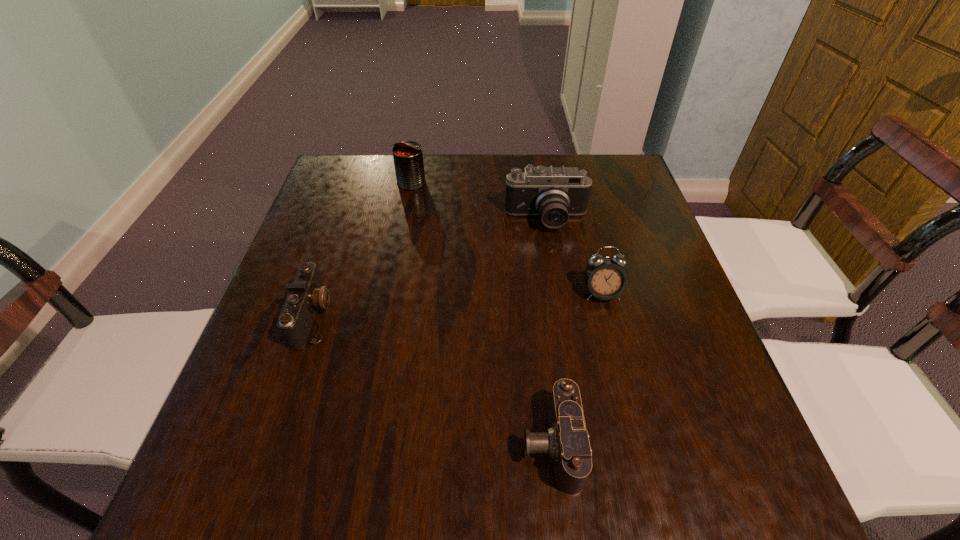
Where is `the farthest object`? The image size is (960, 540). the farthest object is located at coordinates (408, 156).

I want to click on the fourth object from right to left, so click(408, 156).

Find the location of `the second farthest object`. the second farthest object is located at coordinates (554, 193).

You are a GUI agent. You are given a task and a screenshot of the screen. Output one action in this format:
    pyautogui.click(x=<x>, y=<y>)
    Task: Click on the farthest camera
    Image resolution: width=960 pixels, height=540 pixels.
    Given the screenshot: What is the action you would take?
    pyautogui.click(x=554, y=193)

I want to click on alarm clock, so click(x=605, y=278).

Identify the location of the second farthest camera. (307, 293).

The width and height of the screenshot is (960, 540). I want to click on the leftmost object, so click(307, 293).

Where is `the nearest camera`? The height and width of the screenshot is (540, 960). the nearest camera is located at coordinates (566, 441).

Locate an element on the screen. vacant space located on the right of the farthest object is located at coordinates (460, 183).

You are a GUI agent. You are given a task and a screenshot of the screen. Output one action in this format:
    pyautogui.click(x=<x>, y=<y>)
    Task: Click on the free spot located on the front-facing side of the tallest camera
    The image size is (960, 540).
    Given the screenshot: What is the action you would take?
    pyautogui.click(x=571, y=371)